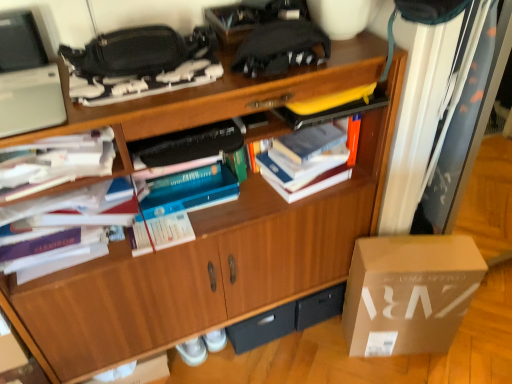
This screenshot has width=512, height=384. Identify the location of black fabric handbag at upper center. (130, 53).

What do you see at coordinates (130, 53) in the screenshot? I see `black fabric handbag at upper center` at bounding box center [130, 53].

Measure the distance between black plastic drawer at lower center and camera.

5.02 feet.

The image size is (512, 384). What do you see at coordinates (262, 328) in the screenshot?
I see `black plastic drawer at lower center` at bounding box center [262, 328].

This screenshot has height=384, width=512. What do you see at coordinates (26, 78) in the screenshot?
I see `silver matte laptop at upper left` at bounding box center [26, 78].

What do you see at coordinates (58, 164) in the screenshot? I see `white paper at upper left, marked as the second book in a right-to-left arrangement` at bounding box center [58, 164].

I want to click on white paper at upper left, marked as the second book in a right-to-left arrangement, so click(x=58, y=164).

Find the location of a particular element. hardcover book at center, acting as the third book starting from the left is located at coordinates (308, 160).

The height and width of the screenshot is (384, 512). I want to click on black fabric handbag at upper center, so click(x=130, y=53).

From the image's perspective, who appears lower, wooden cabinet at center or black plastic drawer at lower center?

black plastic drawer at lower center, from the image's perspective.

Between wooden cabinet at center and black plastic drawer at lower center, which one has larger size?

wooden cabinet at center is bigger.

Would you say wooden cabinet at center contains black plastic drawer at lower center?

Yes, wooden cabinet at center contains black plastic drawer at lower center.

How far apart are wooden cabinet at center and black plastic drawer at lower center?

A distance of 17.89 inches exists between wooden cabinet at center and black plastic drawer at lower center.

Is white cardboard box at lower right aimed at black fabric handbag at upper center?

No, white cardboard box at lower right is not aimed at black fabric handbag at upper center.

Considering the points (458, 285) and (132, 41), which point is in front, point (458, 285) or point (132, 41)?

Positioned in front is point (132, 41).

Measure the distance between white cardboard box at lower right and black fabric handbag at upper center.

3.37 feet.

Locate an element on the screen. The image size is (512, 384). box lying below the black fabric handbag at upper center (from the image's perspective) is located at coordinates (409, 293).

How many degrees apart are the facing directions of white paper at upper left, arranged as the 2th book when viewed from the left, and black plastic drawer at lower center?

The angle between the facing direction of white paper at upper left, arranged as the 2th book when viewed from the left, and the facing direction of black plastic drawer at lower center is 0.436 degrees.

Considering the positions of point (102, 148) and point (263, 338), is point (102, 148) closer or farther from the camera than point (263, 338)?

Point (102, 148).

Could black plastic drawer at lower center be considered to be inside white paper at upper left, marked as the second book in a right-to-left arrangement?

Definitely not — black plastic drawer at lower center is not inside white paper at upper left, marked as the second book in a right-to-left arrangement.

Considering the relative sizes of white paper at upper left, arranged as the 2th book when viewed from the left, and black plastic drawer at lower center in the image provided, is white paper at upper left, arranged as the 2th book when viewed from the left, shorter than black plastic drawer at lower center?

Yes, white paper at upper left, arranged as the 2th book when viewed from the left, is shorter than black plastic drawer at lower center.

Does wooden cabinet at center turn towards white cardboard box at lower right?

No, wooden cabinet at center is not turned towards white cardboard box at lower right.

Considering the sizes of wooden cabinet at center and white cardboard box at lower right in the image, is wooden cabinet at center taller or shorter than white cardboard box at lower right?

Clearly, wooden cabinet at center is taller compared to white cardboard box at lower right.

Is the surface of wooden cabinet at center in direct contact with white cardboard box at lower right?

No, wooden cabinet at center is not touching white cardboard box at lower right.

Considering the relative sizes of wooden cabinet at center and white cardboard box at lower right in the image provided, is wooden cabinet at center smaller than white cardboard box at lower right?

Actually, wooden cabinet at center might be larger than white cardboard box at lower right.

Is hardcover book at center, acting as the third book starting from the left, located outside silver matte laptop at upper left?

Yes, hardcover book at center, acting as the third book starting from the left, is outside of silver matte laptop at upper left.

Does hardcover book at center, which appears as the first book when viewed from the right, have a greater width compared to silver matte laptop at upper left?

No.

Looking at this image, can you confirm if hardcover book at center, acting as the third book starting from the left, is smaller than silver matte laptop at upper left?

No.

I want to click on the 2nd book in front when counting from the white cardboard box at lower right, so click(63, 237).

From a real-world perspective, which is physically below, white paper at left, which is the 1th book from left to right, or white cardboard box at lower right?

In real-world perspective, white cardboard box at lower right is lower.

Which of these two, white paper at left, which appears as the third book when viewed from the right, or white cardboard box at lower right, stands taller?

Standing taller between the two is white cardboard box at lower right.

Are white paper at left, which appears as the third book when viewed from the right, and white cardboard box at lower right located far from each other?

Actually, white paper at left, which appears as the third book when viewed from the right, and white cardboard box at lower right are a little close together.

Is silver matte laptop at upper left positioned with its back to white paper at left, which appears as the third book when viewed from the right?

silver matte laptop at upper left does not have its back to white paper at left, which appears as the third book when viewed from the right.

Would you say white paper at left, which appears as the third book when viewed from the right, is part of silver matte laptop at upper left's contents?

No, white paper at left, which appears as the third book when viewed from the right, is not inside silver matte laptop at upper left.

From a real-world perspective, which is physically below, silver matte laptop at upper left or white paper at left, which is the 1th book from left to right?

From a 3D spatial view, white paper at left, which is the 1th book from left to right, is below.

Is silver matte laptop at upper left far from white paper at left, which appears as the third book when viewed from the right?

They are positioned close to each other.

This screenshot has width=512, height=384. In order to click on cabinetry located on the left of black plastic drawer at lower center in this screenshot , I will do `click(205, 267)`.

This screenshot has width=512, height=384. I want to click on box on the right of the black fabric handbag at upper center, so click(x=409, y=293).

Based on their spatial positions, is white paper at left, which appears as the third book when viewed from the right, or white cardboard box at lower right further from black fabric handbag at upper center?

The object further to black fabric handbag at upper center is white cardboard box at lower right.

Looking at this image, which object lies further to the anchor point silver matte laptop at upper left, white cardboard box at lower right or black plastic drawer at lower center?

white cardboard box at lower right is further to silver matte laptop at upper left.

From the image, which object appears to be nearer to black plastic drawer at lower center, white cardboard box at lower right or silver matte laptop at upper left?

white cardboard box at lower right.

From the image, which object appears to be nearer to white paper at left, which is the 1th book from left to right, white cardboard box at lower right or hardcover book at center, which appears as the first book when viewed from the right?

hardcover book at center, which appears as the first book when viewed from the right.

From the picture: When comparing their distances from hardcover book at center, acting as the third book starting from the left, does white paper at left, which appears as the third book when viewed from the right, or wooden cabinet at center seem closer?

wooden cabinet at center is positioned closer to the anchor hardcover book at center, acting as the third book starting from the left.

From the image, which object appears to be nearer to wooden cabinet at center, black plastic drawer at lower center or white paper at left, which appears as the third book when viewed from the right?

white paper at left, which appears as the third book when viewed from the right.

Looking at the image, which one is located further to white paper at left, which is the 1th book from left to right, wooden cabinet at center or hardcover book at center, acting as the third book starting from the left?

Based on the image, hardcover book at center, acting as the third book starting from the left, appears to be further to white paper at left, which is the 1th book from left to right.

Which object lies nearer to the anchor point white cardboard box at lower right, black fabric handbag at upper center or silver matte laptop at upper left?

black fabric handbag at upper center is positioned closer to the anchor white cardboard box at lower right.

At what (x,y) coordinates should I click in order to perform the action: click on computer between wooden cabinet at center and black plastic drawer at lower center in the front-back direction. Please return your answer as a coordinate pair (x, y). The width and height of the screenshot is (512, 384). Looking at the image, I should click on (26, 78).

Where is `drawer between white paper at upper left, arranged as the 2th book when viewed from the left, and white cardboard box at lower right from left to right`? This screenshot has height=384, width=512. drawer between white paper at upper left, arranged as the 2th book when viewed from the left, and white cardboard box at lower right from left to right is located at coordinates (262, 328).

I want to click on handbag between white paper at left, which appears as the third book when viewed from the right, and hardcover book at center, which appears as the first book when viewed from the right, so click(x=130, y=53).

Where is `handbag situated between white paper at left, which is the 1th book from left to right, and white cardboard box at lower right from left to right`? The width and height of the screenshot is (512, 384). handbag situated between white paper at left, which is the 1th book from left to right, and white cardboard box at lower right from left to right is located at coordinates (130, 53).